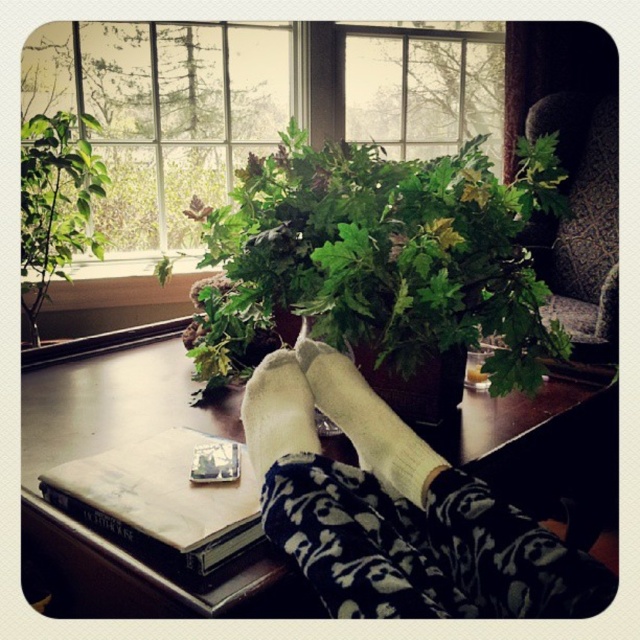
Who is shorter, green leafy plant at center or clear glass window at upper center?

green leafy plant at center is shorter.

Measure the distance between point (349,212) and camera.

The distance of point (349,212) from camera is 33.81 inches.

In order to click on green leafy plant at center in this screenshot , I will do `click(380, 257)`.

Who is positioned more to the right, green leafy plant at center or hardcover book at lower left?

green leafy plant at center is more to the right.

Is green leafy plant at center closer to camera compared to hardcover book at lower left?

No, it is not.

Between point (509, 216) and point (173, 541), which one is positioned behind?

Point (509, 216)

The image size is (640, 640). I want to click on green leafy plant at center, so click(x=380, y=257).

Which is behind, point (145, 40) or point (22, 275)?

The point (145, 40) is more distant.

Which of these two, transparent glass window at upper center or green leafy plant at left, stands taller?

Standing taller between the two is transparent glass window at upper center.

You are a GUI agent. You are given a task and a screenshot of the screen. Output one action in this format:
    pyautogui.click(x=<x>, y=<y>)
    Task: Click on the transparent glass window at upper center
    
    Given the screenshot: What is the action you would take?
    (x=250, y=104)